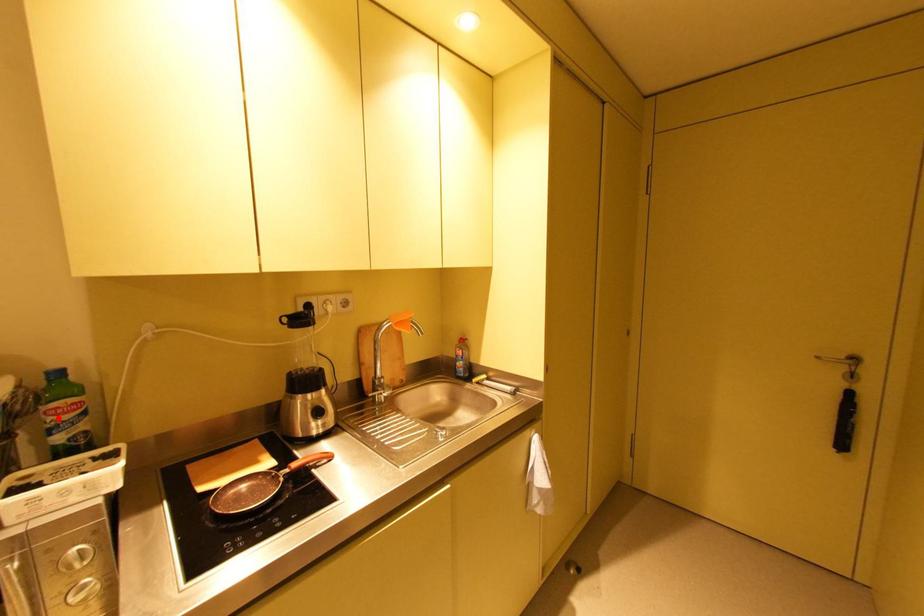
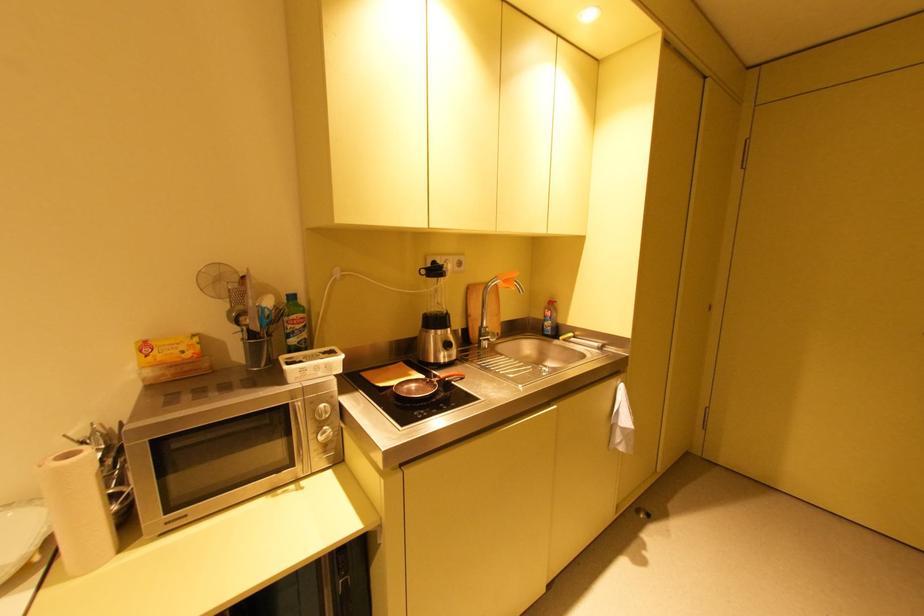
Where in the second image is the point corresponding to the highlighted location from the first image?

(296, 326)